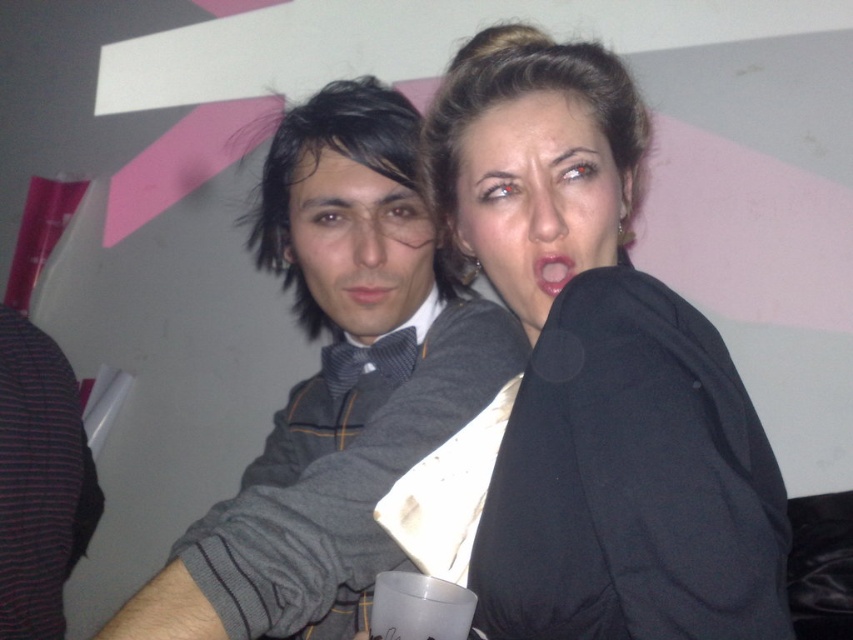
You are organizing a costume party and need to decide which item takes up more space horizontally. Based on the image, which item is wider between the gray striped sweater at center and the matte gray bow tie at center?

The gray striped sweater at center is wider than the matte gray bow tie at center according to the description.

You are a photographer adjusting camera settings to focus on the two central objects in the image. Which object should you adjust the focus to first if you want to capture both the matte black hair at center and the matte gray bow tie at center in sharp detail?

The matte black hair at center is taller than the matte gray bow tie at center, so you should focus on the matte black hair at center first to ensure both are in sharp detail.

You are standing in the room and want to reach the point at coordinates (567, 93). If your arm can extend 25 inches, can you touch it without moving closer?

The point at coordinates (567, 93) is 25.80 inches away from the viewer. Since your arm can only extend 25 inches, you cannot reach it without moving closer.